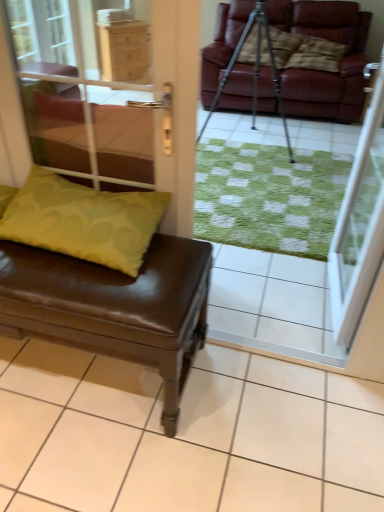
Question: In terms of height, does green fabric cushion at lower left, the second screen door in the right-to-left sequence, look taller or shorter compared to brown leather bench at lower left?

Choices:
 (A) short
 (B) tall

Answer: (B)

Question: From a real-world perspective, is green fabric cushion at lower left, the second screen door in the right-to-left sequence, positioned above or below brown leather bench at lower left?

Choices:
 (A) above
 (B) below

Answer: (A)

Question: Estimate the real-world distances between objects in this image. Which object is farther from the green fabric pillow at left?

Choices:
 (A) transparent glass screen door at upper right, arranged as the 1th screen door when viewed from the right
 (B) green fabric cushion at lower left, positioned as the 1th screen door in left-to-right order
 (C) brown leather bench at lower left
 (D) metallic tripod at center

Answer: (B)

Question: Which object is positioned closest to the green fabric pillow at left?

Choices:
 (A) brown leather bench at lower left
 (B) green fabric cushion at lower left, positioned as the 1th screen door in left-to-right order
 (C) metallic tripod at center
 (D) transparent glass screen door at upper right, arranged as the 1th screen door when viewed from the right

Answer: (A)